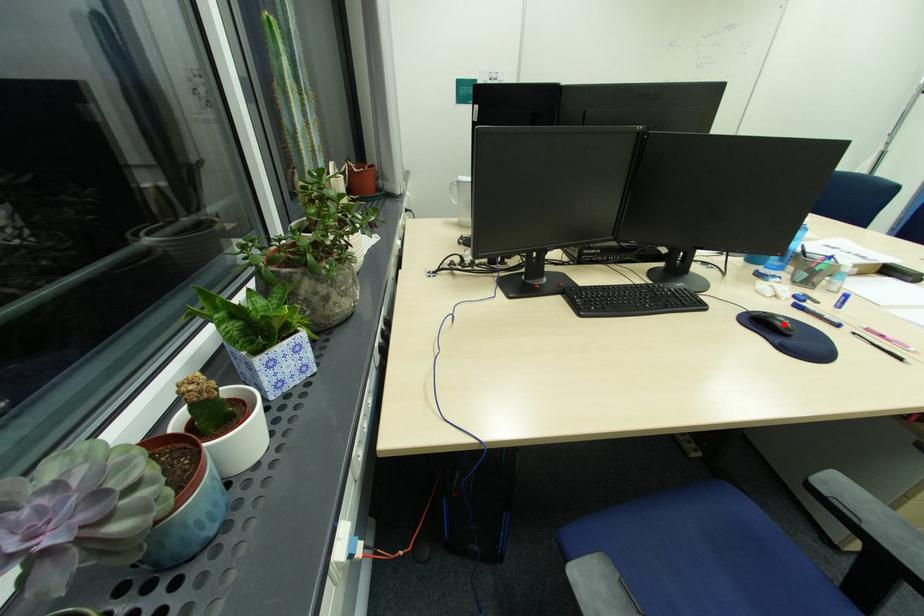
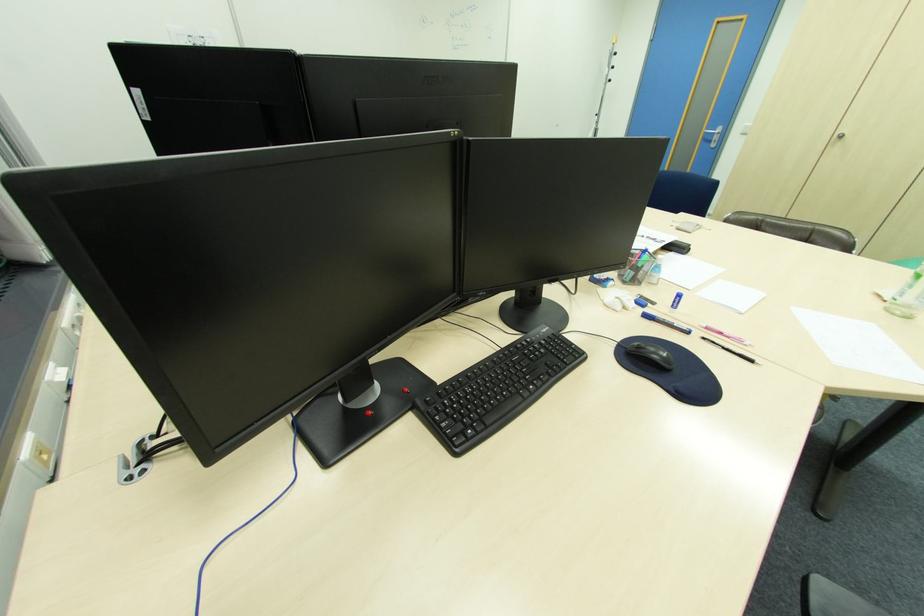
The point at the highlighted location is marked in the first image. Where is the corresponding point in the second image?

(662, 358)